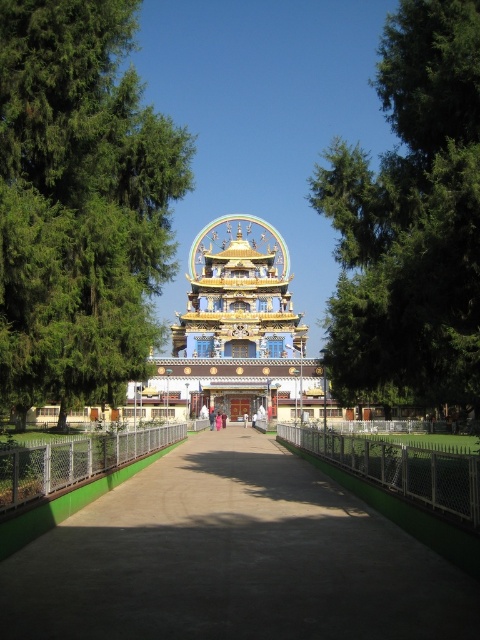
You are a visitor approaching the temple and notice the green concrete path at center and the green leafy tree at upper left. Which one appears closer to you as you walk towards the temple?

The green concrete path at center appears closer because it is shorter in distance compared to the green leafy tree at upper left.

You are a visitor standing at the base of the green leafy tree at upper left, wanting to reach the golden ornate temple at center. If your walking speed is 1.5 meters per second, how many seconds will it take you to reach the temple?

The distance between the green leafy tree at upper left and the golden ornate temple at center is 42.08 meters. At a walking speed of 1.5 meters per second, it would take approximately 28.05 seconds to reach the temple.

You are a visitor approaching the temple and want to take a photo that includes both the green leafy tree at upper left and the golden ornate temple at center. Which object should you position closer to the edge of the frame to ensure both are fully visible?

The green leafy tree at upper left is smaller in size compared to the golden ornate temple at center, so you should position the green leafy tree at upper left closer to the edge of the frame to ensure both are fully visible.